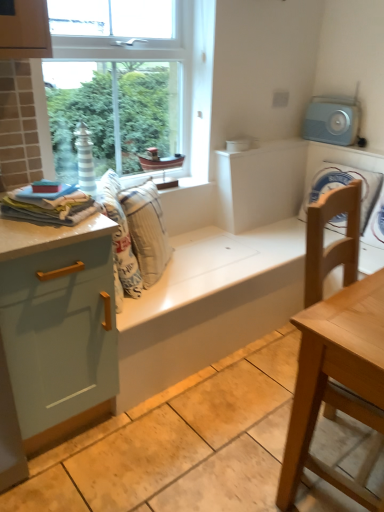
Question: Considering the positions of light blue plastic radio at upper right and white matte cabinet at center in the image, is light blue plastic radio at upper right bigger or smaller than white matte cabinet at center?

Choices:
 (A) big
 (B) small

Answer: (B)

Question: Is light blue plastic radio at upper right taller or shorter than white matte cabinet at center?

Choices:
 (A) tall
 (B) short

Answer: (B)

Question: Which is farther from the beige fabric cushion at center, which is the first material in back-to-front order?

Choices:
 (A) soft cotton towels at left, arranged as the 2th material when viewed from the back
 (B) light blue plastic radio at upper right
 (C) white matte cabinet at center
 (D) light wood table at right
 (E) light blue glossy cabinet at left

Answer: (B)

Question: Which object is the closest to the beige fabric cushion at center, which is the second material from left to right?

Choices:
 (A) soft cotton towels at left, the 1th material positioned from the front
 (B) light blue glossy cabinet at left
 (C) white matte cabinet at center
 (D) light wood table at right
 (E) light blue plastic radio at upper right

Answer: (A)